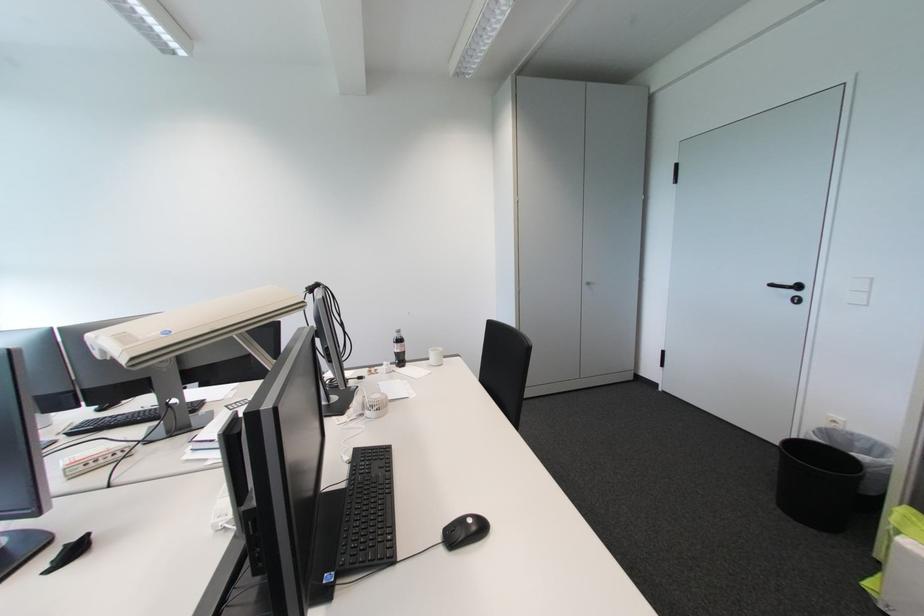
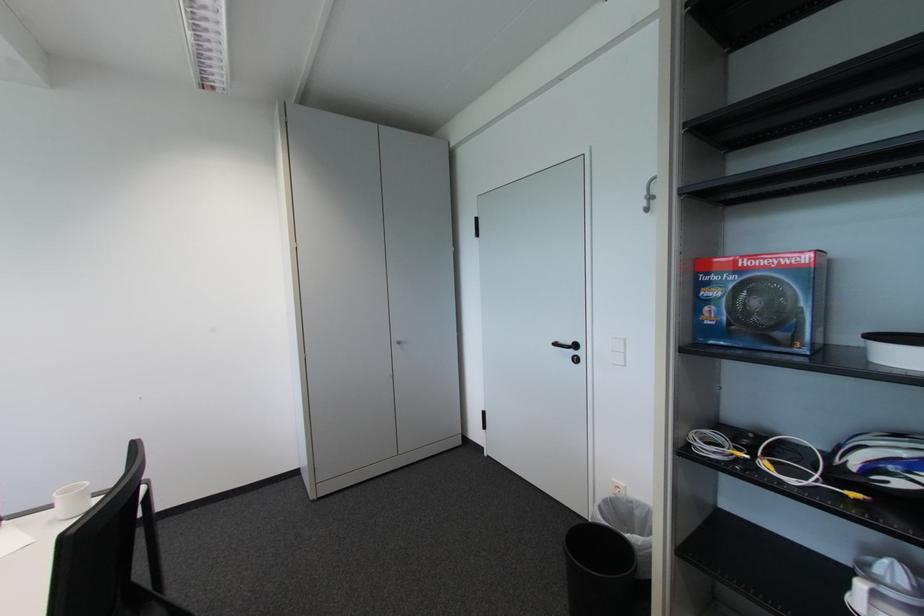
Question: The first image is from the beginning of the video and the second image is from the end. How did the camera likely rotate when shooting the video?

Choices:
 (A) Left
 (B) Right
 (C) Up
 (D) Down

Answer: (B)